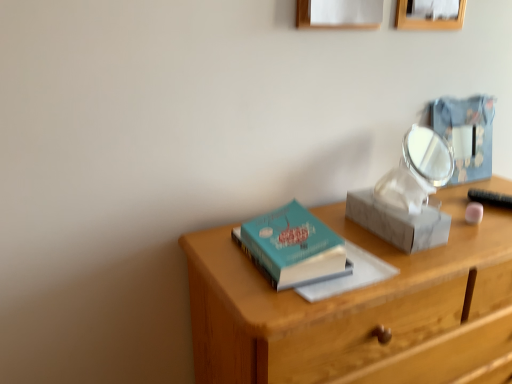
Where is `vacant space in front of white marble shoe box at center-right`? This screenshot has width=512, height=384. vacant space in front of white marble shoe box at center-right is located at coordinates (419, 265).